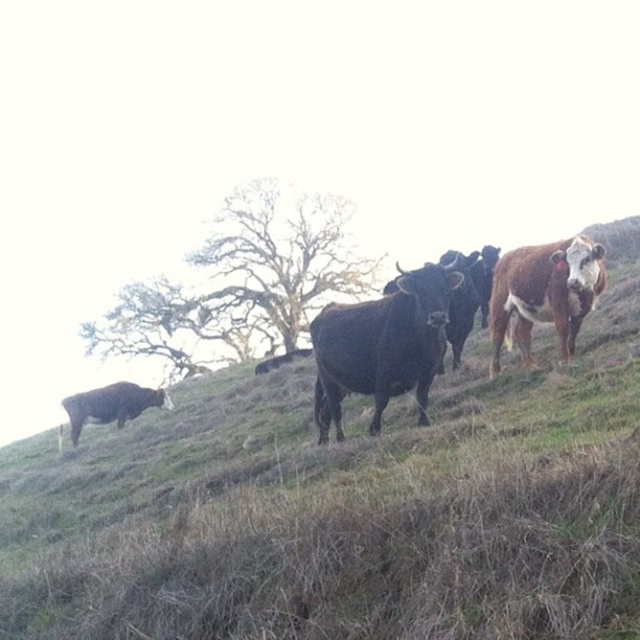
Question: Is bare wood tree at upper center to the left of shiny brown bull at lower left from the viewer's perspective?

Choices:
 (A) yes
 (B) no

Answer: (A)

Question: Which object appears farthest from the camera in this image?

Choices:
 (A) shiny brown bull at lower left
 (B) brown textured cow at right

Answer: (A)

Question: Does green grass at center appear under black glossy bull at center?

Choices:
 (A) no
 (B) yes

Answer: (B)

Question: Based on their relative distances, which object is nearer to the shiny brown bull at lower left?

Choices:
 (A) green grass at center
 (B) bare wood tree at upper center
 (C) brown textured cow at right

Answer: (A)

Question: Estimate the real-world distances between objects in this image. Which object is closer to the shiny brown bull at lower left?

Choices:
 (A) black glossy bull at center
 (B) brown textured cow at right
 (C) bare wood tree at upper center
 (D) green grass at center

Answer: (D)

Question: Is green grass at center above black glossy bull at center?

Choices:
 (A) no
 (B) yes

Answer: (A)